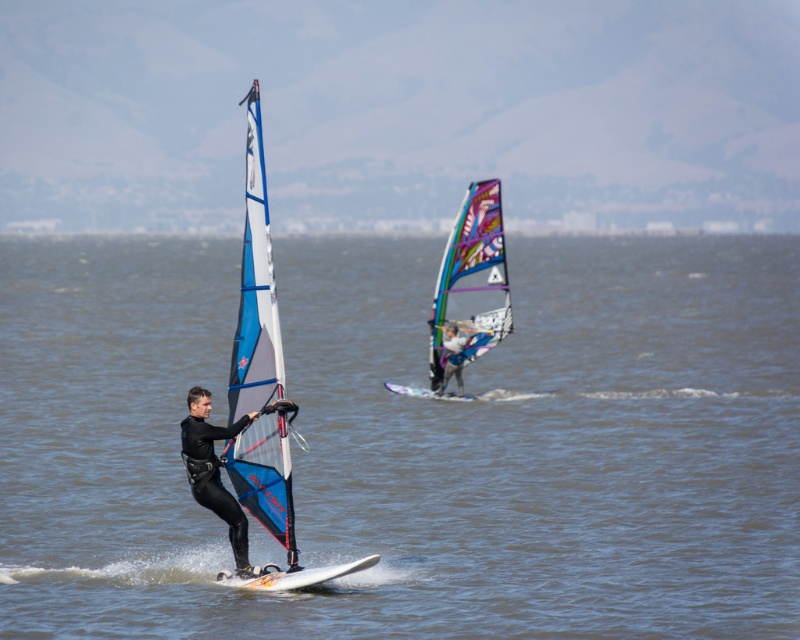
Question: Among these points, which one is nearest to the camera?

Choices:
 (A) (260, 452)
 (B) (16, 486)
 (C) (433, 378)

Answer: (A)

Question: Can you confirm if blue/white sail at center is wider than multicolored mesh sail at center?

Choices:
 (A) no
 (B) yes

Answer: (A)

Question: Based on their relative distances, which object is nearer to the black matte wetsuit at center?

Choices:
 (A) clear blue water at center
 (B) blue/white sail at center
 (C) matte blue sail at center
 (D) multicolored mesh sail at center

Answer: (B)

Question: Does clear blue water at center appear over multicolored mesh sail at center?

Choices:
 (A) no
 (B) yes

Answer: (B)

Question: Which of the following is the closest to the observer?

Choices:
 (A) matte blue sail at center
 (B) clear blue water at center

Answer: (B)

Question: From the image, what is the correct spatial relationship of clear blue water at center in relation to multicolored mesh sail at center?

Choices:
 (A) above
 (B) below

Answer: (A)